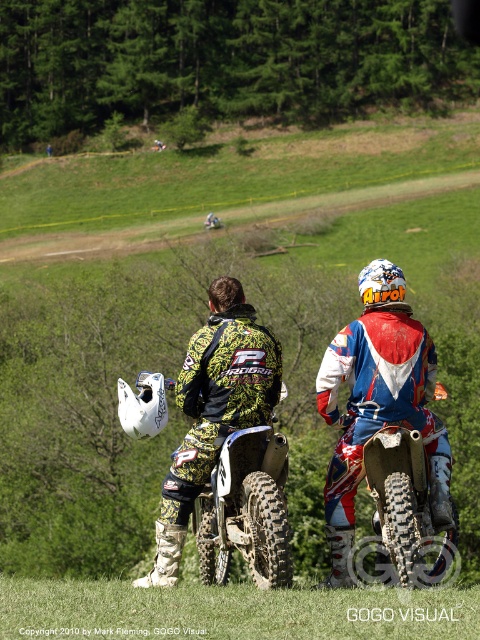
You are a photographer positioned at the edge of the motocross track. You need to capture a photo where both the camouflage fabric jacket at center and the red and white motocross bike at center are clearly visible. Considering their sizes, which object should you focus on first to ensure both are in frame?

The camouflage fabric jacket at center is smaller than the red and white motocross bike at center. To ensure both are in frame, focus on the smaller camouflage fabric jacket at center first, then adjust to include the larger bike.

You are a photographer setting up a shot of the green grass at lower center and the red and white motocross bike at center. To ensure both subjects are in focus, you need to know which is closer to the camera. Based on the scene description, which object is closer to the camera?

The green grass at lower center is closer to the camera than the red and white motocross bike at center because it is shorter than the bike, implying it occupies a lower plane in the image.